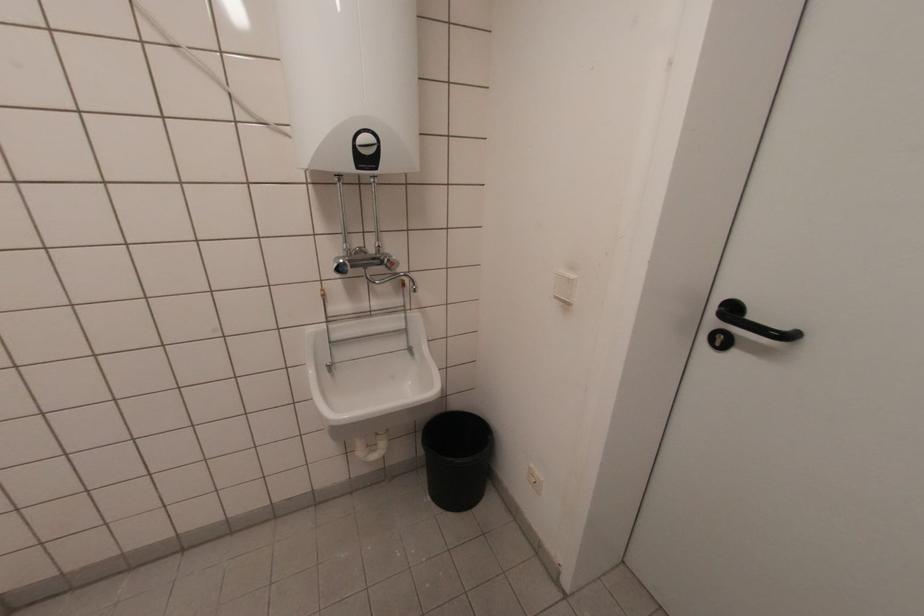
Which object does [456,459] point to?

This point indicates the black trash can.